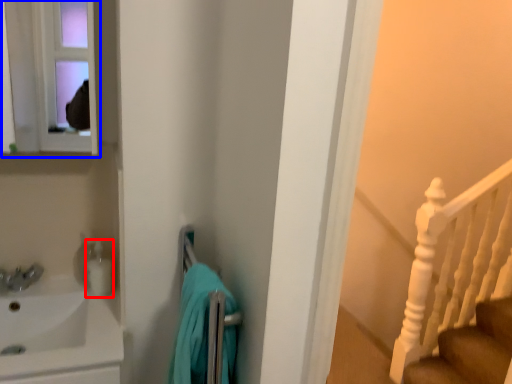
Question: Which of the following is the farthest to the observer, toiletry (highlighted by a red box) or medicine cabinet (highlighted by a blue box)?

Choices:
 (A) toiletry
 (B) medicine cabinet

Answer: (A)